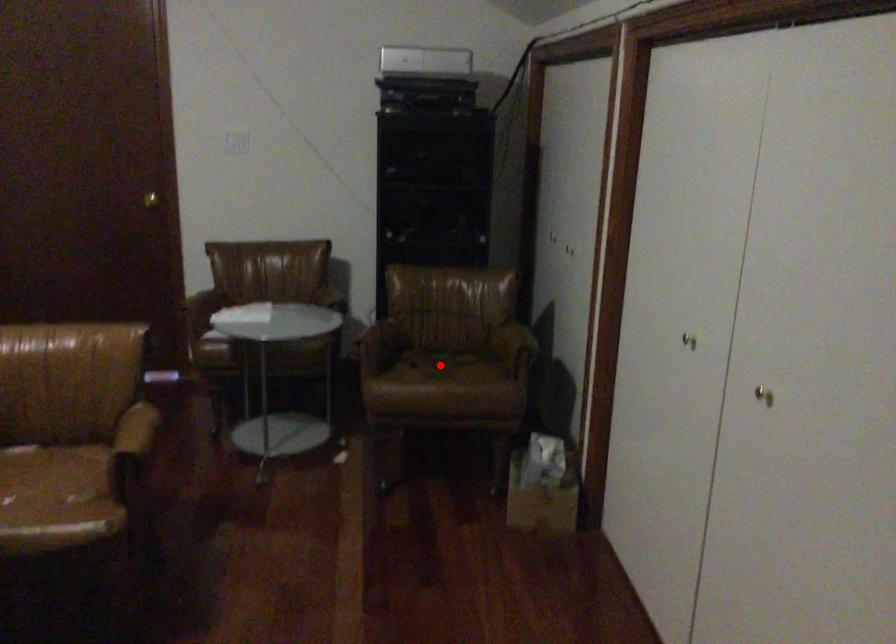
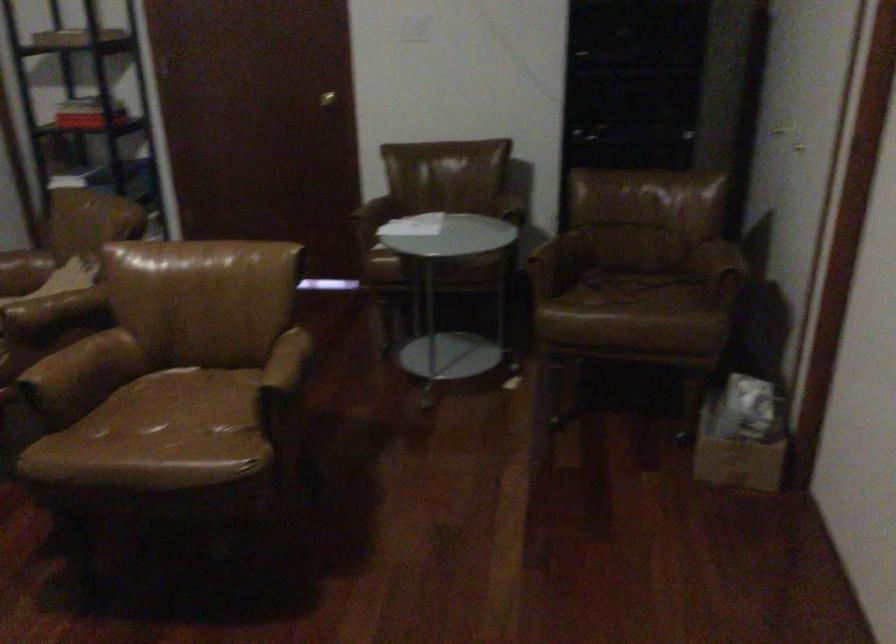
Question: I am providing you with two images of the same scene from different viewpoints. A red point is shown in image1. For the corresponding object point in image2, is it positioned nearer or farther from the camera?

Choices:
 (A) Nearer
 (B) Farther

Answer: (A)